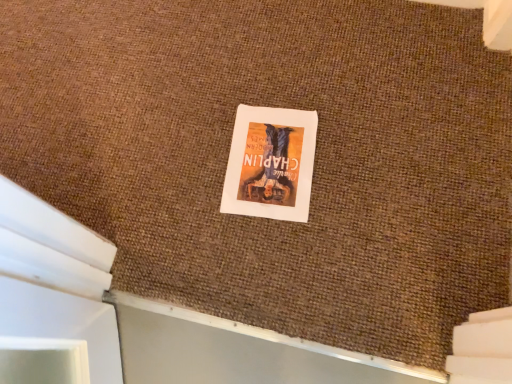
Where is `free spot behind matte paper poster at center`? The width and height of the screenshot is (512, 384). free spot behind matte paper poster at center is located at coordinates (257, 77).